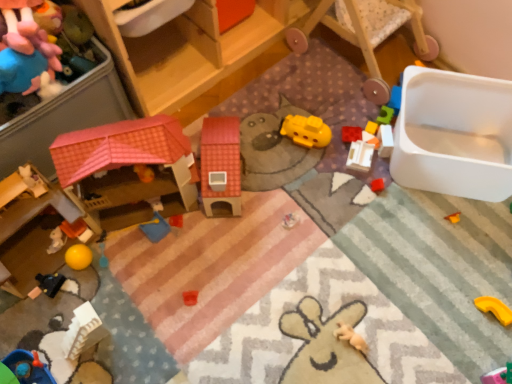
The width and height of the screenshot is (512, 384). I want to click on vacant area that lies between rubber brick at upper right, placed as the 7th toy when sorted from left to right, and matte plastic dollhouse at center-left, the fourth toy viewed from the left, so click(x=282, y=170).